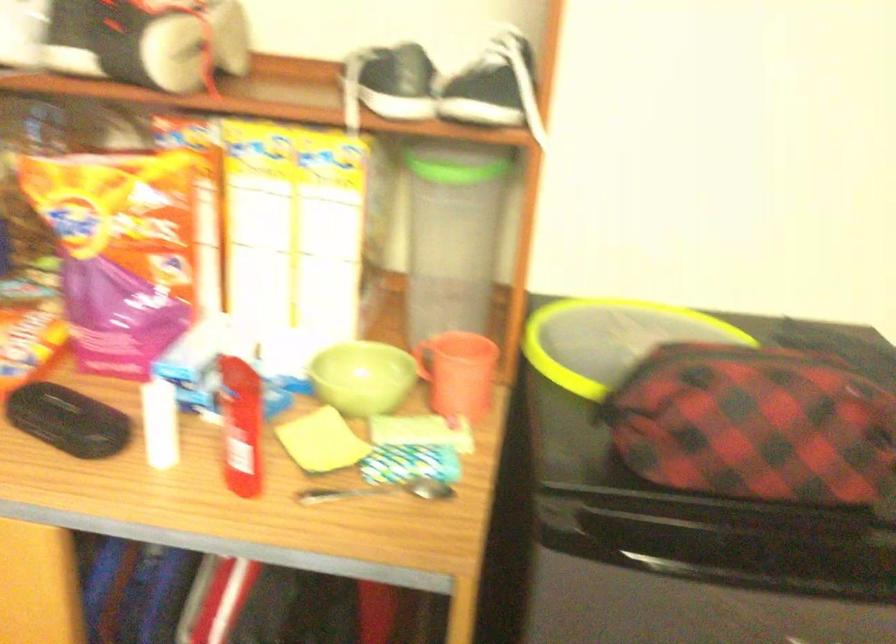
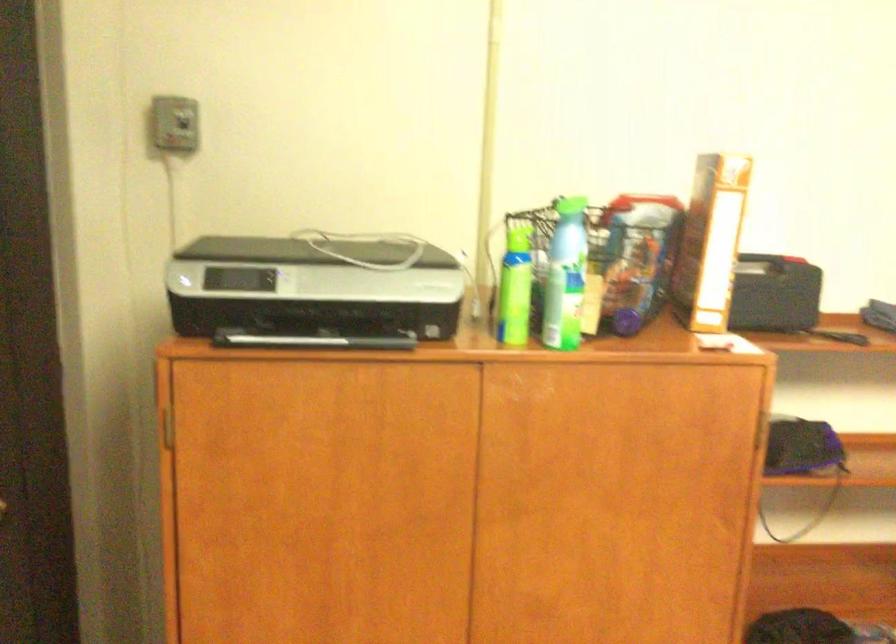
Consider the image. The images are taken continuously from a first-person perspective. In which direction is your viewpoint rotating?

The camera rotated toward right-down.